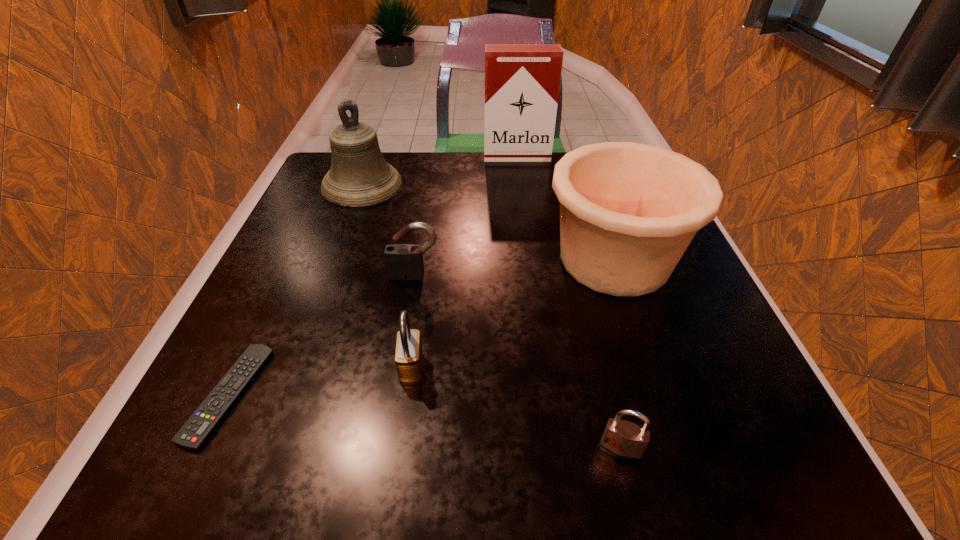
This screenshot has width=960, height=540. Find the location of `bell present at the left edge`. bell present at the left edge is located at coordinates (359, 176).

Locate an element on the screen. The height and width of the screenshot is (540, 960). remote control situated at the left edge is located at coordinates (197, 430).

You are a GUI agent. You are given a task and a screenshot of the screen. Output one action in this format:
    pyautogui.click(x=<x>, y=<y>)
    Task: Click on the object at the right edge
    Image resolution: width=960 pixels, height=540 pixels.
    Given the screenshot: What is the action you would take?
    pyautogui.click(x=628, y=211)

Identify the location of object present at the far left corner. (359, 176).

Locate an element on the screen. The width and height of the screenshot is (960, 540). object positioned at the near left corner is located at coordinates (197, 430).

The width and height of the screenshot is (960, 540). Identify the location of free space at the far edge of the desktop. (435, 180).

The width and height of the screenshot is (960, 540). I want to click on vacant space at the near edge of the desktop, so click(536, 428).

Identify the location of vacant space at the left edge of the desktop. (265, 370).

Find the location of a particular element. The width and height of the screenshot is (960, 540). vacant area that lies between the second farthest object and the remote control is located at coordinates (295, 290).

Where is `free space between the tallest object and the farthest padlock`? The height and width of the screenshot is (540, 960). free space between the tallest object and the farthest padlock is located at coordinates (466, 216).